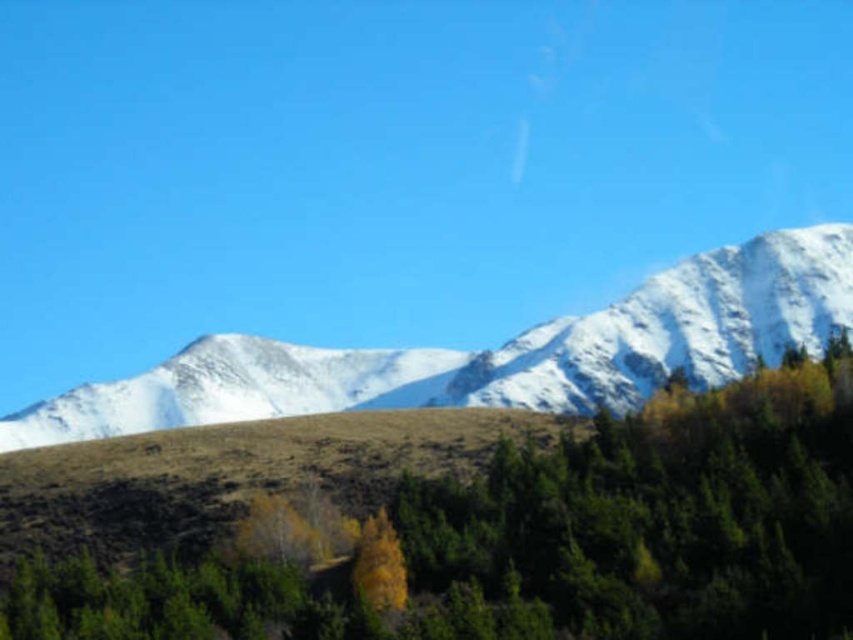
Question: Can you confirm if yellow-green leafy tree at center is positioned to the right of white snow-covered mountain range at center?

Choices:
 (A) no
 (B) yes

Answer: (B)

Question: Which point is farther to the camera?

Choices:
 (A) (546, 385)
 (B) (560, 356)
 (C) (612, 576)

Answer: (B)

Question: Which point appears closest to the camera in this image?

Choices:
 (A) (795, 228)
 (B) (163, 576)
 (C) (344, 381)

Answer: (B)

Question: Does yellow-green leafy tree at center have a lesser width compared to white snow-covered mountain range at center?

Choices:
 (A) no
 (B) yes

Answer: (B)

Question: Can you confirm if yellow-green leafy tree at center is bigger than white snow-covered mountain at upper right?

Choices:
 (A) no
 (B) yes

Answer: (A)

Question: Which of the following is the farthest from the observer?

Choices:
 (A) (795, 336)
 (B) (764, 321)
 (C) (712, 403)

Answer: (B)